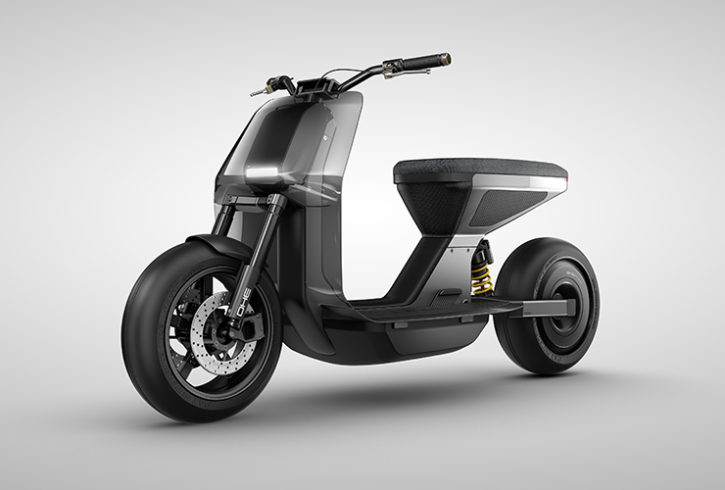
Locate an element on the screen. left handle is located at coordinates (420, 60).